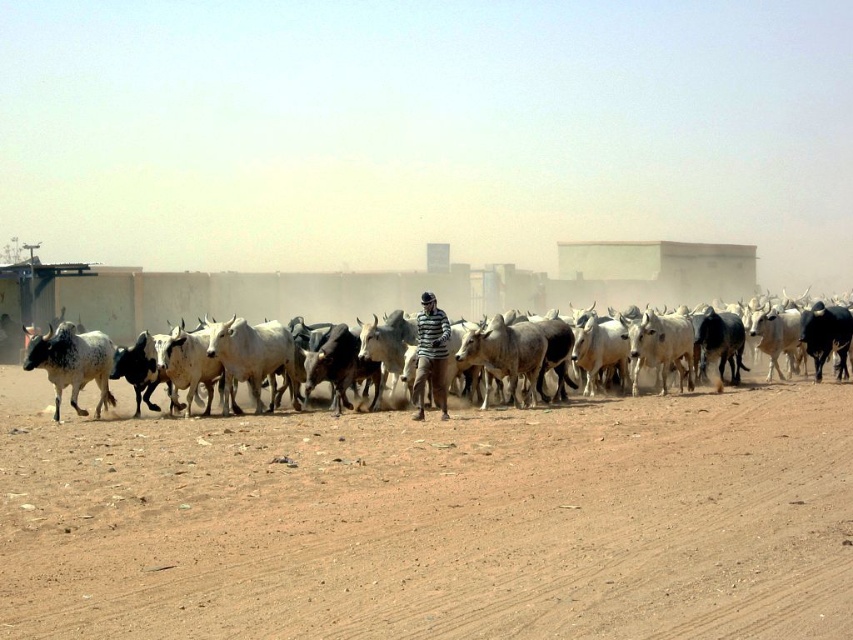
Question: Which of the following is the farthest from the observer?

Choices:
 (A) (683, 348)
 (B) (419, 387)

Answer: (A)

Question: Is speckled white cow at left smaller than striped shirt at center?

Choices:
 (A) no
 (B) yes

Answer: (B)

Question: Which point is closer to the camera?

Choices:
 (A) (79, 364)
 (B) (450, 332)
 (C) (779, 372)

Answer: (B)

Question: Does speckled white cow at left come in front of striped shirt at center?

Choices:
 (A) yes
 (B) no

Answer: (B)

Question: Is speckled white cow at left wider than striped shirt at center?

Choices:
 (A) yes
 (B) no

Answer: (B)

Question: Among these objects, which one is farthest from the camera?

Choices:
 (A) brown sandy dirt at center
 (B) striped shirt at center
 (C) speckled white cow at left

Answer: (C)